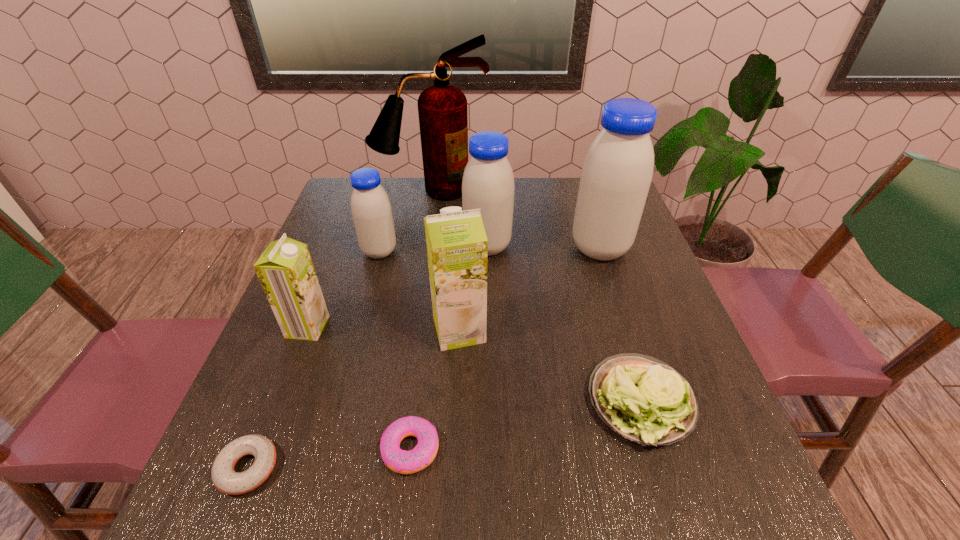
In the image, there is a desktop. At what (x,y) coordinates should I click in order to perform the action: click on vacant space at the far edge. Please return your answer as a coordinate pair (x, y). Looking at the image, I should click on (410, 207).

Where is `vacant space at the near edge of the desktop`? This screenshot has width=960, height=540. vacant space at the near edge of the desktop is located at coordinates (465, 483).

At what (x,y) coordinates should I click in order to perform the action: click on vacant region at the left edge of the desktop. Please return your answer as a coordinate pair (x, y). The height and width of the screenshot is (540, 960). Looking at the image, I should click on (329, 237).

Locate an element on the screen. This screenshot has width=960, height=540. free space at the right edge of the desktop is located at coordinates (616, 262).

The width and height of the screenshot is (960, 540). In the image, there is a desktop. Find the location of `vacant space at the far right corner`. vacant space at the far right corner is located at coordinates (571, 190).

This screenshot has height=540, width=960. I want to click on free space between the tallest soya milk and the third shortest object, so click(x=620, y=326).

What are the coordinates of `vacant space that is in between the left doughnut and the left green soya milk` in the screenshot? It's located at (277, 397).

Where is `vacant area between the right doughnut and the farthest object`? The image size is (960, 540). vacant area between the right doughnut and the farthest object is located at coordinates coord(420,319).

The width and height of the screenshot is (960, 540). In order to click on empty location between the farthest object and the rightmost soya milk in this screenshot , I will do `click(516, 219)`.

The image size is (960, 540). Find the location of `free space between the bigger green soya milk and the smallest blue soya milk`. free space between the bigger green soya milk and the smallest blue soya milk is located at coordinates (420, 291).